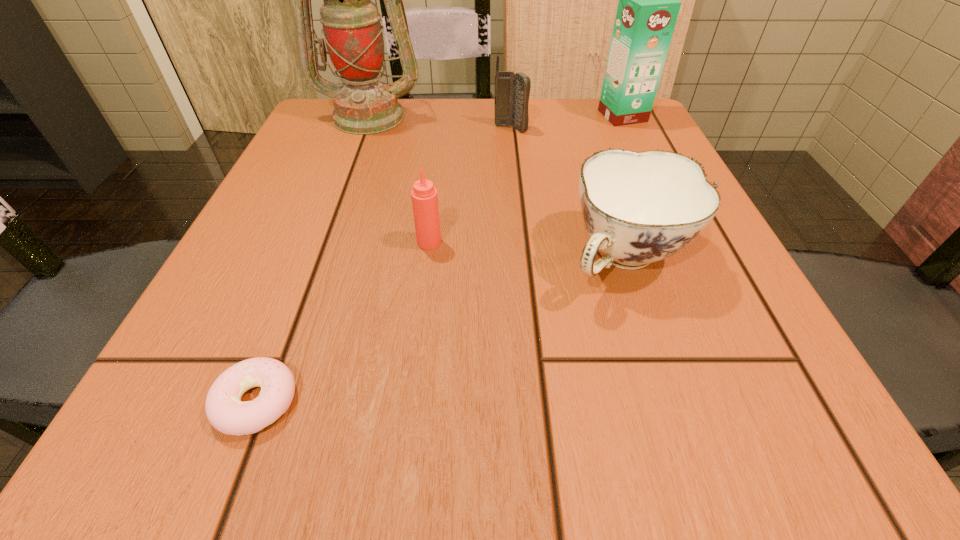
This screenshot has height=540, width=960. In order to click on blank space located 0.180m on the back of the Tabasco sauce in this screenshot , I will do `click(438, 171)`.

This screenshot has height=540, width=960. Identify the location of free spot located 0.130m on the front of the chinaware. [x=672, y=400].

This screenshot has width=960, height=540. Find the location of `free space located on the back of the shortest object`. free space located on the back of the shortest object is located at coordinates (282, 333).

Locate an element on the screen. Image resolution: width=960 pixels, height=540 pixels. oil lamp at the far edge is located at coordinates (353, 34).

Where is `carton positioned at the far edge`? Image resolution: width=960 pixels, height=540 pixels. carton positioned at the far edge is located at coordinates (648, 7).

Where is `cellular telephone located in the far edge section of the desktop`? This screenshot has width=960, height=540. cellular telephone located in the far edge section of the desktop is located at coordinates (512, 91).

Find the location of a particular element. The width and height of the screenshot is (960, 540). object that is at the near edge is located at coordinates (225, 411).

Locate an element on the screen. Image resolution: width=960 pixels, height=540 pixels. oil lamp that is at the left edge is located at coordinates (353, 34).

Locate an element on the screen. doughnut that is positioned at the left edge is located at coordinates (225, 411).

Where is `carton that is at the right edge`? carton that is at the right edge is located at coordinates (648, 7).